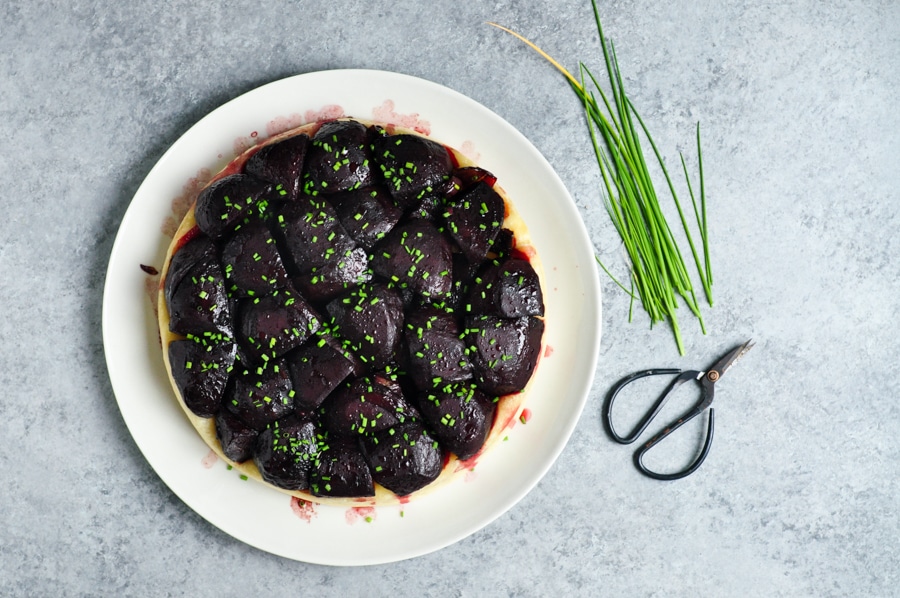
You are a GUI agent. You are given a task and a screenshot of the screen. Output one action in this format:
    pyautogui.click(x=<x>, y=<y>)
    Task: Click on the handle
    The image size is (900, 598).
    Given the screenshot: What is the action you would take?
    coord(688,469)